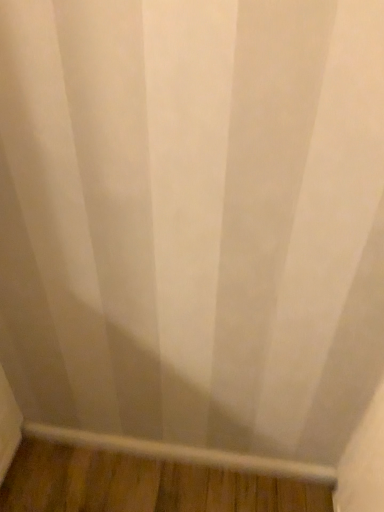
What do you see at coordinates (184, 453) in the screenshot?
I see `white smooth molding at lower center` at bounding box center [184, 453].

In order to face white smooth molding at lower center, should I rotate leftwards or rightwards?

Rotate your view left by about 2.500°.

This screenshot has width=384, height=512. I want to click on white smooth molding at lower center, so click(x=184, y=453).

Find the location of a particular element. white smooth molding at lower center is located at coordinates point(184,453).